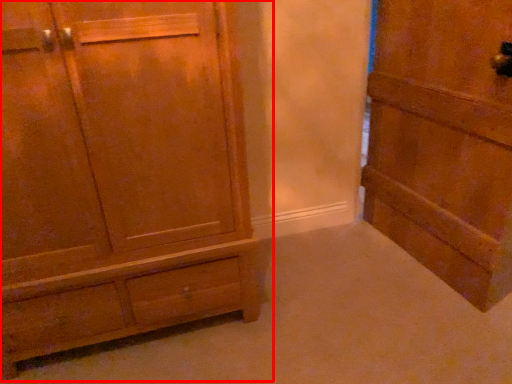
Question: Observing the image, what is the correct spatial positioning of chest of drawers (annotated by the red box) in reference to door?

Choices:
 (A) right
 (B) left

Answer: (B)